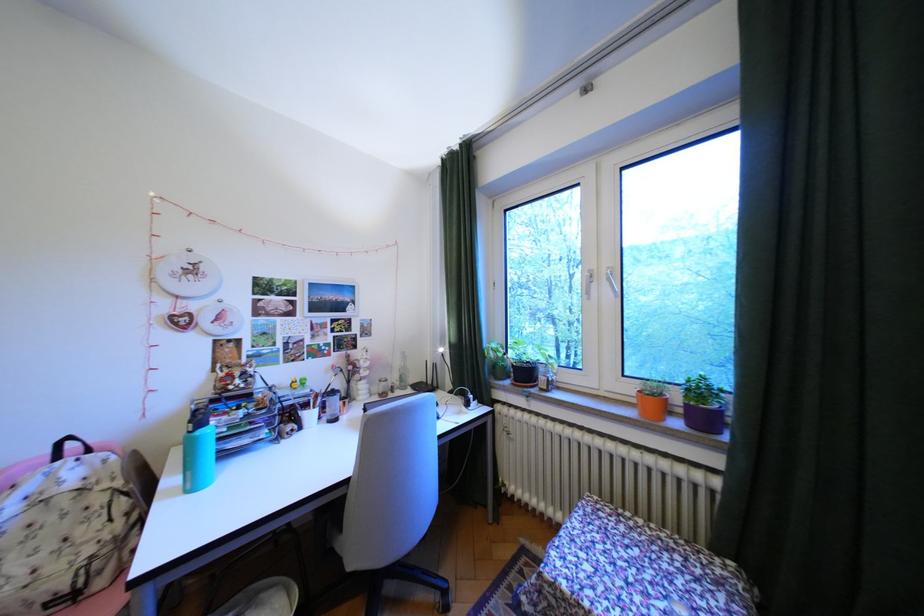
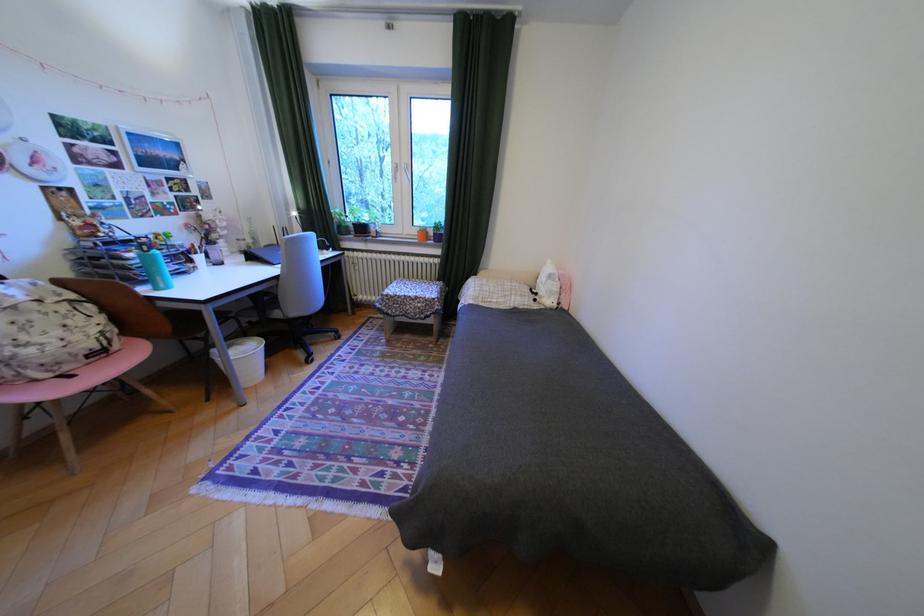
Where in the second image is the point corresponding to [605,285] from the first image?

(410, 174)